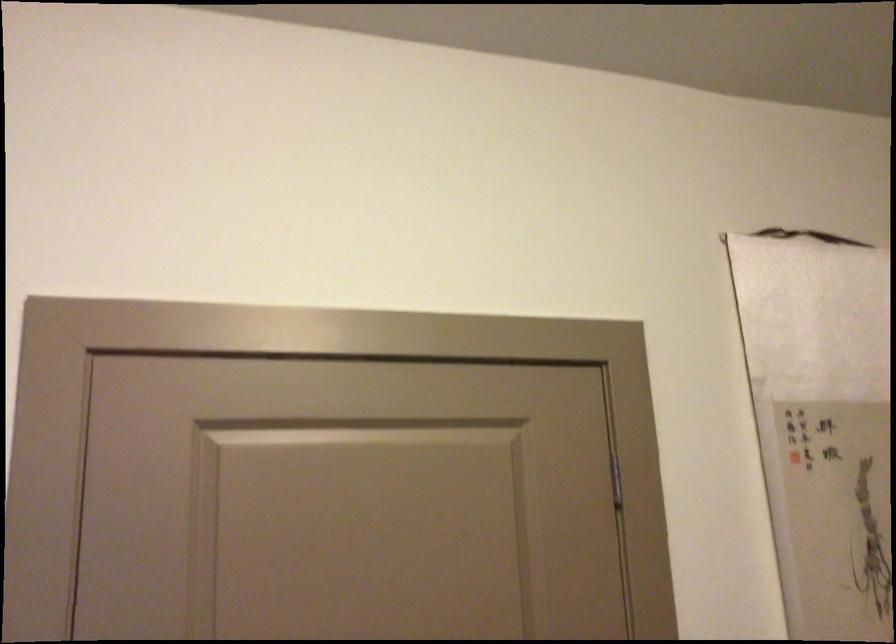
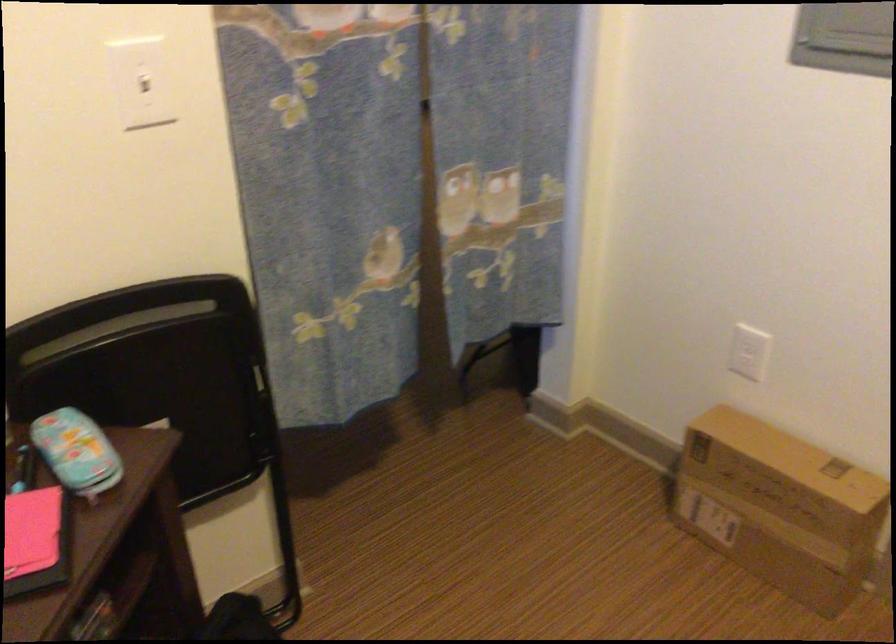
The first image is from the beginning of the video and the second image is from the end. How did the camera likely rotate when shooting the video?

The rotation direction of the camera is left-down.